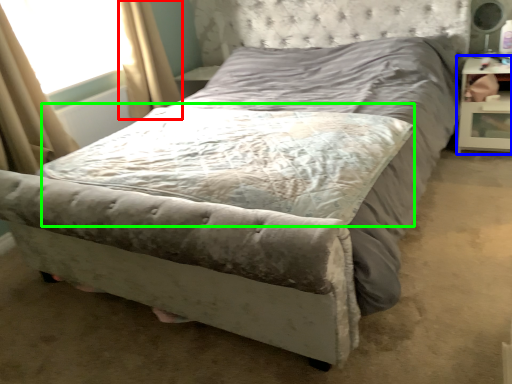
Question: Estimate the real-world distances between objects in this image. Which object is farther from curtain (highlighted by a red box), nightstand (highlighted by a blue box) or mattress (highlighted by a green box)?

Choices:
 (A) nightstand
 (B) mattress

Answer: (A)